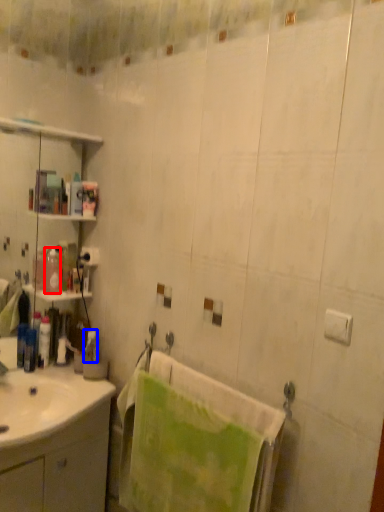
Question: Which point is closer to the camera, toiletry (highlighted by a red box) or toiletry (highlighted by a blue box)?

Choices:
 (A) toiletry
 (B) toiletry

Answer: (A)